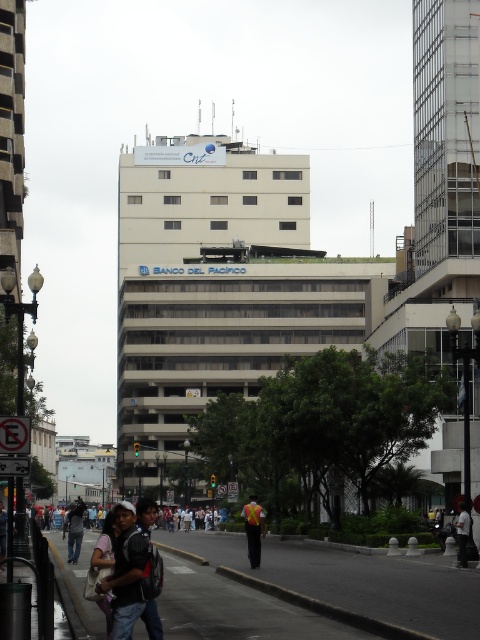
Who is more forward, (457, 577) or (168, 508)?

Point (457, 577)

Measure the distance between point (471, 572) and camera.

A: Point (471, 572) is 29.29 meters away from camera.

Identify the location of concrete sidewalk at lower left. This screenshot has height=640, width=480. (355, 579).

Which is behind, point (307, 540) or point (250, 557)?

The point (307, 540) is behind.

Is concrete sidewalk at lower left to the left of reflective yellow vest at center from the viewer's perspective?

Incorrect, concrete sidewalk at lower left is not on the left side of reflective yellow vest at center.

Which is behind, point (388, 588) or point (256, 508)?

The point (256, 508) is behind.

Locate an element on the screen. concrete sidewalk at lower left is located at coordinates (355, 579).

In the scene shown: Does concrete sidewalk at lower left have a greater height compared to denim jacket at lower left?

No, concrete sidewalk at lower left is not taller than denim jacket at lower left.

Does concrete sidewalk at lower left have a greater width compared to denim jacket at lower left?

In fact, concrete sidewalk at lower left might be narrower than denim jacket at lower left.

This screenshot has height=640, width=480. What do you see at coordinates (355, 579) in the screenshot? I see `concrete sidewalk at lower left` at bounding box center [355, 579].

The width and height of the screenshot is (480, 640). Identify the location of concrete sidewalk at lower left. (355, 579).